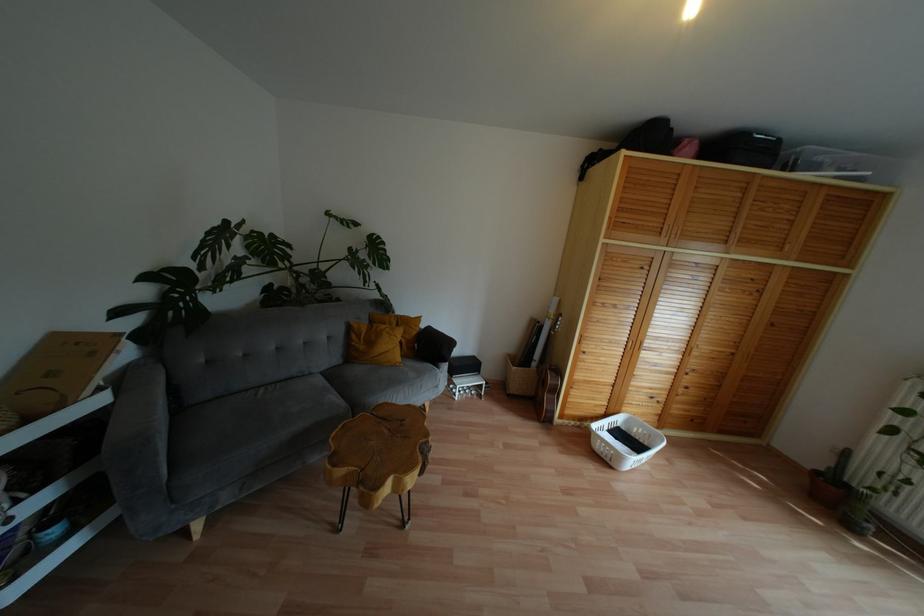
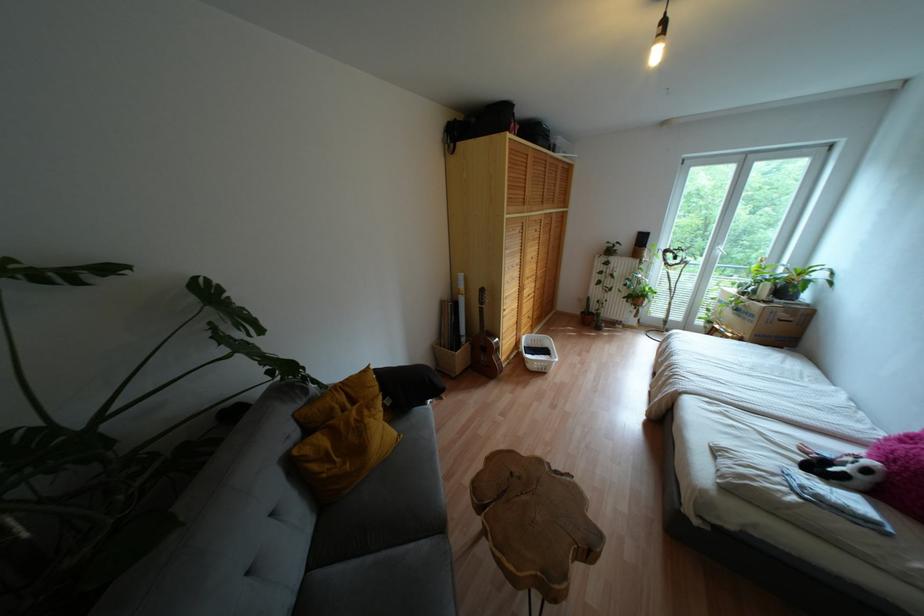
The point at (x=606, y=460) is marked in the first image. Where is the corresponding point in the second image?

(542, 370)